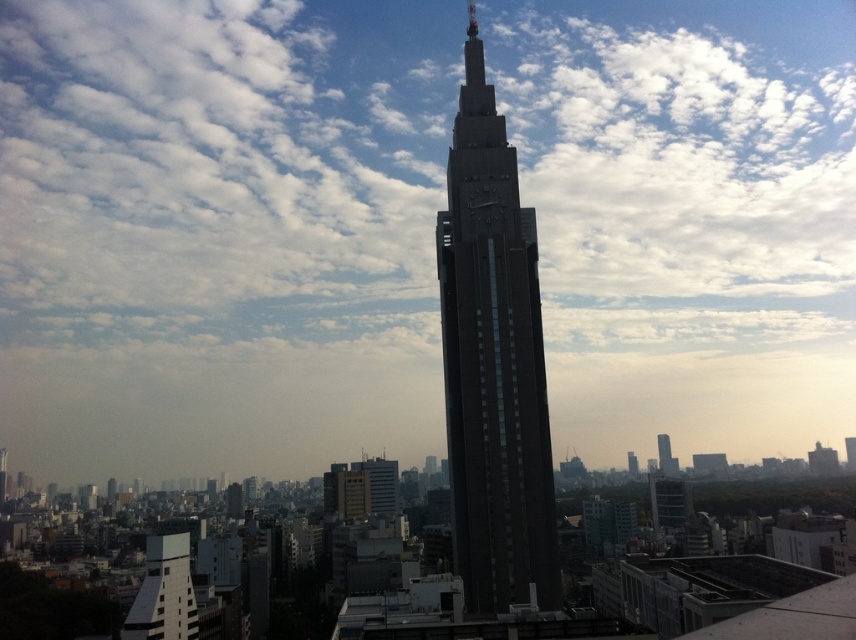
Question: Does dark brown glass tower at center have a larger size compared to white textured building at lower left?

Choices:
 (A) yes
 (B) no

Answer: (A)

Question: Is dark brown glass tower at center behind white textured building at lower left?

Choices:
 (A) yes
 (B) no

Answer: (A)

Question: Which point appears closest to the camera in this image?

Choices:
 (A) (169, 634)
 (B) (551, 589)

Answer: (A)

Question: Which of the following is the farthest from the observer?

Choices:
 (A) (548, 550)
 (B) (158, 538)

Answer: (B)

Question: Which of the following is the farthest from the observer?

Choices:
 (A) (470, 60)
 (B) (156, 536)

Answer: (B)

Question: From the image, what is the correct spatial relationship of dark brown glass tower at center in relation to white textured building at lower left?

Choices:
 (A) above
 (B) below

Answer: (A)